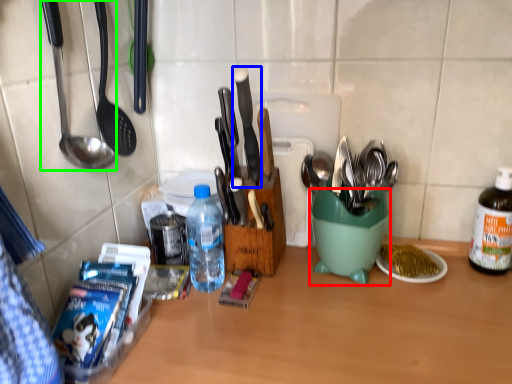
Question: Based on their relative distances, which object is farther from mixing bowl (highlighted by a red box)? Choose from knife (highlighted by a blue box) and spoon (highlighted by a green box).

Choices:
 (A) knife
 (B) spoon

Answer: (B)